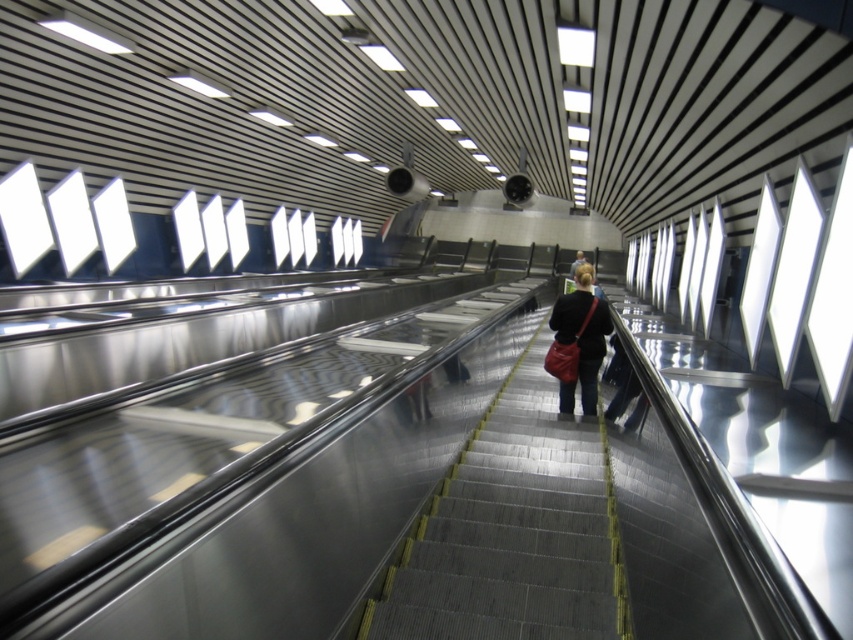
Question: Which point is closer to the camera taking this photo?

Choices:
 (A) (599, 522)
 (B) (572, 260)

Answer: (A)

Question: Is black leather jacket at center in front of dark blue jeans at center?

Choices:
 (A) no
 (B) yes

Answer: (B)

Question: Can you confirm if metallic gray stairs at center is smaller than dark blue jeans at center?

Choices:
 (A) yes
 (B) no

Answer: (A)

Question: Which object appears farthest from the camera in this image?

Choices:
 (A) dark blue jeans at center
 (B) black leather jacket at center

Answer: (A)

Question: Observing the image, what is the correct spatial positioning of black leather jacket at center in reference to dark blue jeans at center?

Choices:
 (A) below
 (B) above

Answer: (A)

Question: Which of the following is the farthest from the observer?

Choices:
 (A) metallic gray stairs at center
 (B) black leather jacket at center

Answer: (B)